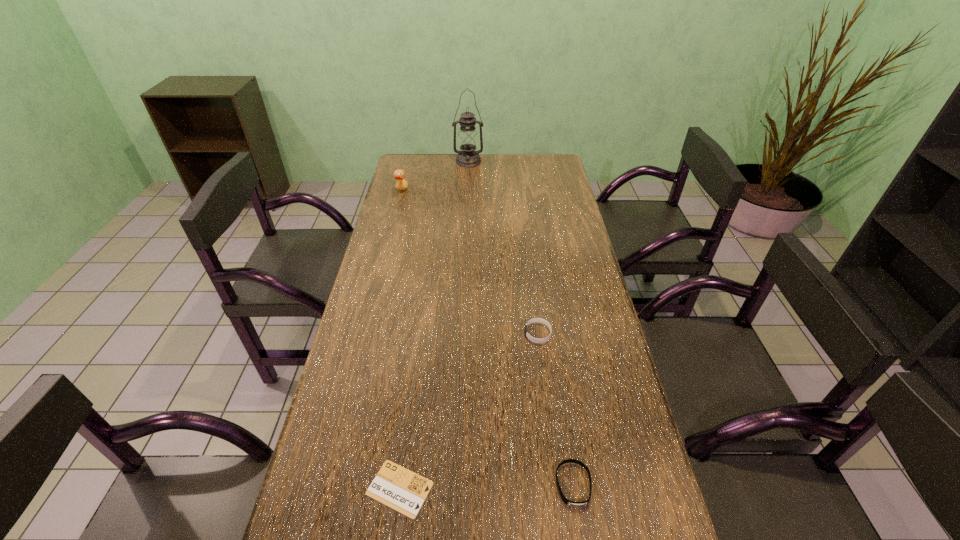
The height and width of the screenshot is (540, 960). I want to click on the tallest object, so click(468, 140).

Where is `oil lamp`? The height and width of the screenshot is (540, 960). oil lamp is located at coordinates (468, 140).

Where is `the fourth shortest object`? The height and width of the screenshot is (540, 960). the fourth shortest object is located at coordinates (399, 175).

Where is `duck`? duck is located at coordinates (399, 175).

Identify the location of the taller wristband. This screenshot has height=540, width=960. (534, 320).

Locate an element on the screen. This screenshot has width=960, height=540. the farther wristband is located at coordinates (534, 320).

This screenshot has height=540, width=960. I want to click on the second shortest object, so click(x=570, y=503).

Where is `the nearer wristband`? the nearer wristband is located at coordinates (570, 503).

This screenshot has width=960, height=540. I want to click on the shortest object, so click(395, 486).

This screenshot has width=960, height=540. Identify the location of vacant area located on the front of the tallest object. (468, 185).